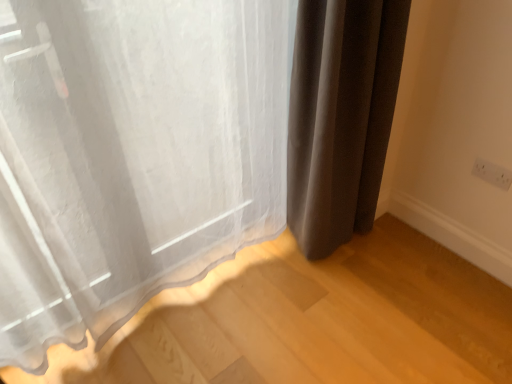
This screenshot has height=384, width=512. Find the location of `free space in front of dark velvet curtain at right`. free space in front of dark velvet curtain at right is located at coordinates (351, 287).